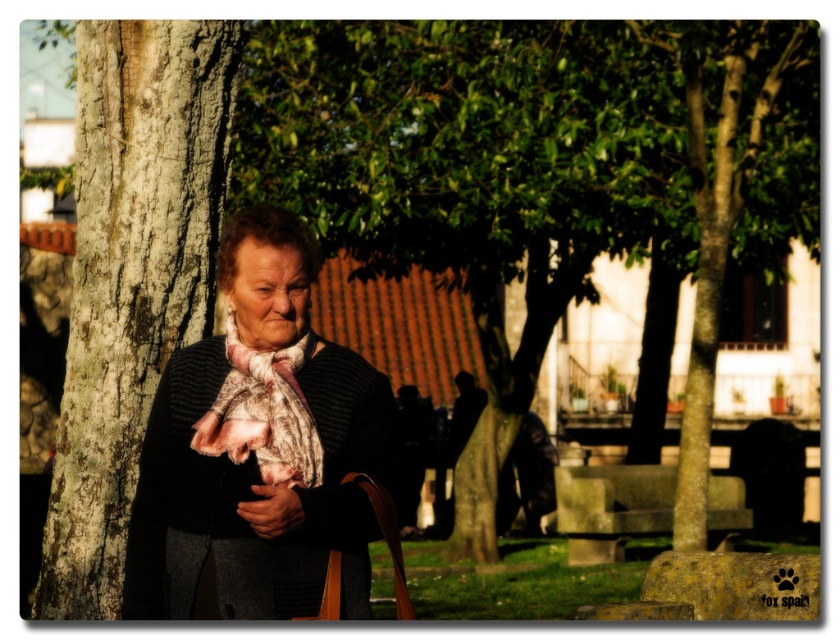
You are a fashion designer observing an elderly woman in a park. You notice she is wearing a dark gray fabric jacket at center and carrying a smooth brown leather handbag at lower center. Which item is positioned lower on her body?

The dark gray fabric jacket at center is below the smooth brown leather handbag at lower center, so the jacket is positioned lower on her body.

You are a fashion designer observing the scene and want to create a design that complements both the dark gray fabric jacket at center and the smooth brown leather handbag at lower center. Considering their sizes, which object should you focus on to ensure the design balances proportions?

The dark gray fabric jacket at center is taller than the smooth brown leather handbag at lower center, so focusing on the jacket for proportion balance would be better as it has a larger vertical dimension.

You are standing at the point with coordinates point (462, 380) and want to move towards the point with coordinates point (264, 474). Based on the scene description, which direction should you move?

You should move forward because point (264, 474) is in front of point (462, 380).